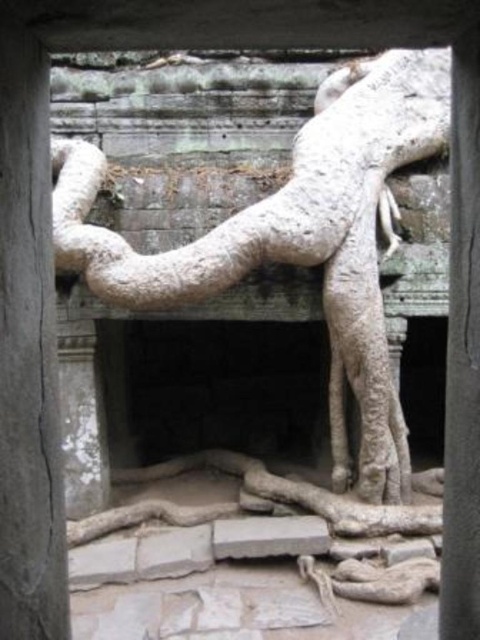
Question: Is white rough stone roots at upper center positioned before gray stone pillar at center?

Choices:
 (A) no
 (B) yes

Answer: (A)

Question: Does gray stone pillar at center appear under smooth stone pillar at center?

Choices:
 (A) yes
 (B) no

Answer: (B)

Question: Estimate the real-world distances between objects in this image. Which object is farther from the white rough stone roots at upper center?

Choices:
 (A) gray stone pillar at center
 (B) smooth stone pillar at center

Answer: (A)

Question: Which is nearer to the white rough stone roots at upper center?

Choices:
 (A) gray stone pillar at center
 (B) smooth stone pillar at center

Answer: (B)

Question: Among these points, which one is nearest to the camera?

Choices:
 (A) (26, 388)
 (B) (455, 497)

Answer: (A)

Question: Can you confirm if gray stone pillar at center is wider than smooth stone pillar at center?

Choices:
 (A) yes
 (B) no

Answer: (A)